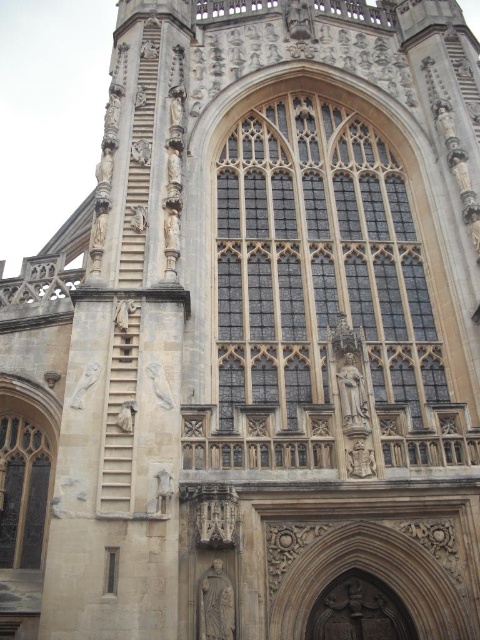
Is stained glass window at center positioned before dark glass window at lower left?

Yes, stained glass window at center is in front of dark glass window at lower left.

Between point (348, 160) and point (14, 452), which one is positioned in front?

Point (14, 452) is more forward.

Identify the location of stained glass window at center. The image size is (480, 640). (319, 291).